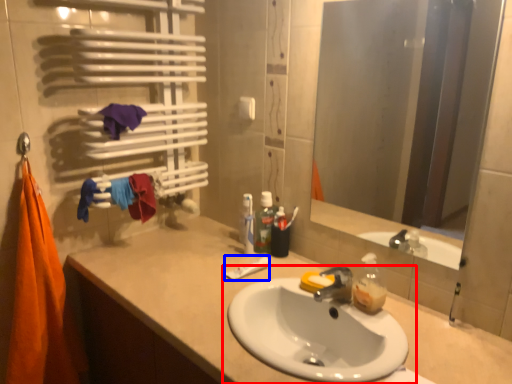
Question: Which point is closer to the camera, sink (highlighted by a red box) or toothpaste (highlighted by a blue box)?

Choices:
 (A) sink
 (B) toothpaste

Answer: (A)